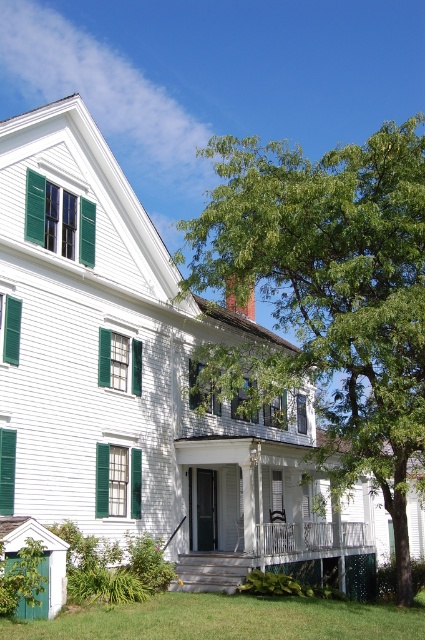
Question: Is green leafy tree at center thinner than green painted wood shutter at upper center?

Choices:
 (A) no
 (B) yes

Answer: (A)

Question: Which of the following is the farthest from the observer?

Choices:
 (A) (260, 536)
 (B) (252, 248)

Answer: (A)

Question: Where is green painted wood shutters at upper left located in relation to green matte shutter at left in the image?

Choices:
 (A) above
 (B) below

Answer: (A)

Question: Which point is farther from the camera taking this photo?

Choices:
 (A) (410, 332)
 (B) (354, 529)

Answer: (B)

Question: Considering the real-world distances, which object is farthest from the green painted wood shutter at upper center?

Choices:
 (A) green matte shutter at lower left
 (B) green matte shutter at left
 (C) green painted wood shutters at upper left
 (D) green grass at lower center

Answer: (B)

Question: Can you confirm if green leafy tree at center is positioned to the left of green painted wood shutters at upper left?

Choices:
 (A) no
 (B) yes

Answer: (A)